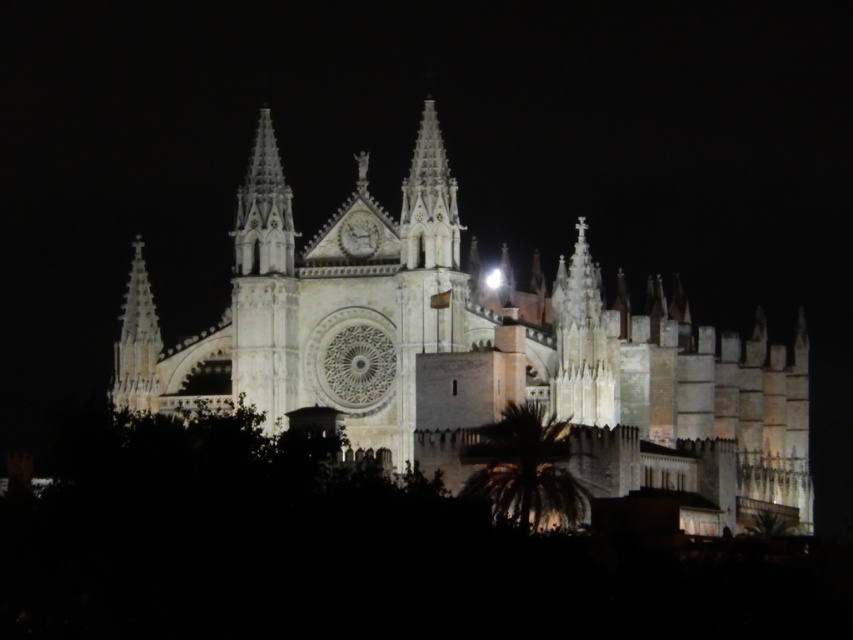
Which is above, white stone church at center or green leafy palm at lower center?

Positioned higher is white stone church at center.

Which is below, white stone church at center or green leafy palm at lower center?

green leafy palm at lower center is below.

Image resolution: width=853 pixels, height=640 pixels. Find the location of `white stone church at center`. white stone church at center is located at coordinates (491, 352).

Where is `white stone church at center`? white stone church at center is located at coordinates (491, 352).

This screenshot has height=640, width=853. What do you see at coordinates (524, 467) in the screenshot?
I see `green leafy palm at lower center` at bounding box center [524, 467].

You are a GUI agent. You are given a task and a screenshot of the screen. Output one action in this format:
    pyautogui.click(x=<x>, y=<y>)
    Task: Click on the green leafy palm at lower center
    The height and width of the screenshot is (640, 853).
    Given the screenshot: What is the action you would take?
    click(x=524, y=467)

Who is more forward, (378, 292) or (128, 296)?

Point (378, 292)

The image size is (853, 640). I want to click on white stone church at center, so click(491, 352).